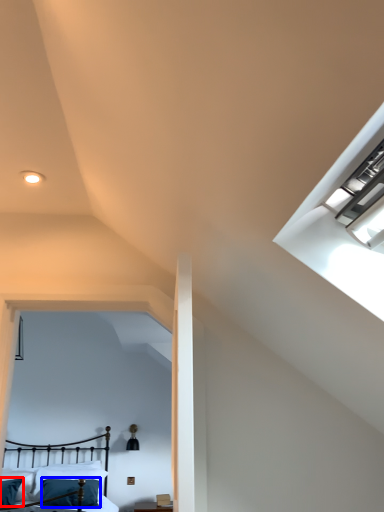
Question: Which object appears farthest to the camera in this image, pillow (highlighted by a red box) or pillow (highlighted by a blue box)?

Choices:
 (A) pillow
 (B) pillow

Answer: (B)